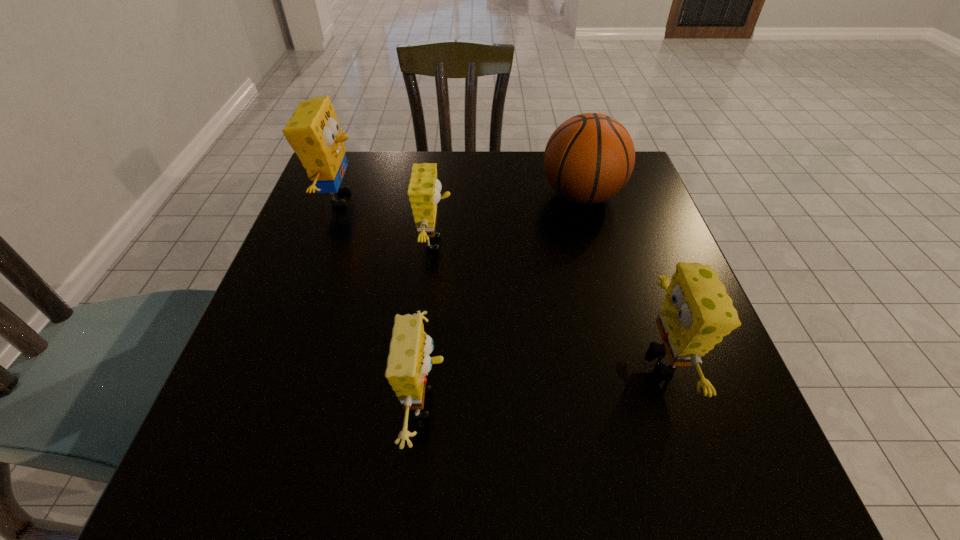
At what (x,y) coordinates should I click in order to perform the action: click on basketball present at the far edge. Please return your answer as a coordinate pair (x, y). Looking at the image, I should click on (589, 158).

In order to click on object located at the near edge in this screenshot , I will do `click(408, 363)`.

At what (x,y) coordinates should I click in order to perform the action: click on object at the left edge. Please return your answer as a coordinate pair (x, y). Looking at the image, I should click on (313, 132).

Find the location of a particular element. The image size is (960, 540). basketball situated at the right edge is located at coordinates (589, 158).

In order to click on sponge at the right edge in this screenshot , I will do `click(696, 314)`.

Locate an element on the screen. The width and height of the screenshot is (960, 540). object that is positioned at the far left corner is located at coordinates (313, 132).

At what (x,y) coordinates should I click in order to perform the action: click on object that is at the far right corner. Please return your answer as a coordinate pair (x, y). Looking at the image, I should click on (589, 158).

At what (x,y) coordinates should I click in order to perform the action: click on free space at the far edge of the desktop. Please return your answer as a coordinate pair (x, y). This screenshot has height=540, width=960. Looking at the image, I should click on (398, 191).

Where is `vacant space at the near edge of the desktop`? The height and width of the screenshot is (540, 960). vacant space at the near edge of the desktop is located at coordinates (592, 480).

The image size is (960, 540). In the image, there is a desktop. In order to click on free region at the left edge in this screenshot , I will do `click(328, 348)`.